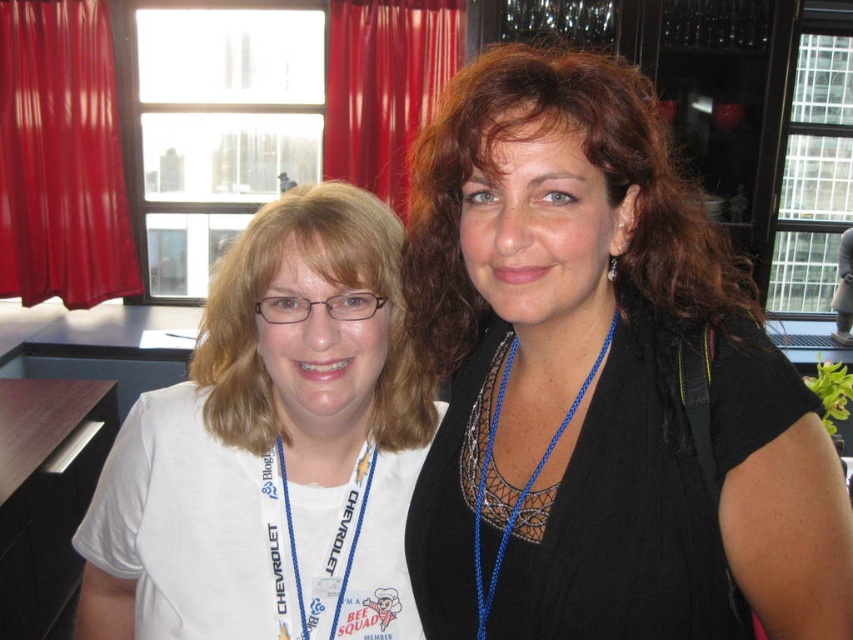
You are organizing a costume party and need to decide which item is more suitable for a superhero theme. Based on their material thickness, which item would be better for a superhero costume? The black mesh top at center or the red velvet curtain at upper left?

The black mesh top at center is thinner than the red velvet curtain at upper left, so the red velvet curtain at upper left would be more suitable for a superhero costume due to its thicker material providing more structure and durability.

You are taking a photo of two people standing in a room with a camera that has a depth sensor. The camera is positioned at the same level as their eyes. You notice two points marked in the image at coordinates point [448,481] and point [389,131]. Which point is closer to the camera?

Point [448,481] is closer to the camera than point [389,131].